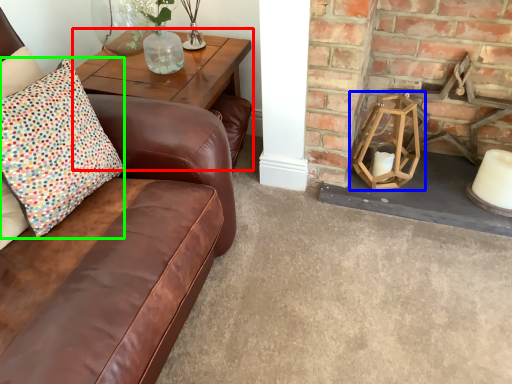
Question: Estimate the real-world distances between objects in this image. Which object is closer to table (highlighted by a red box), candle holder (highlighted by a blue box) or pillow (highlighted by a green box)?

Choices:
 (A) candle holder
 (B) pillow

Answer: (B)